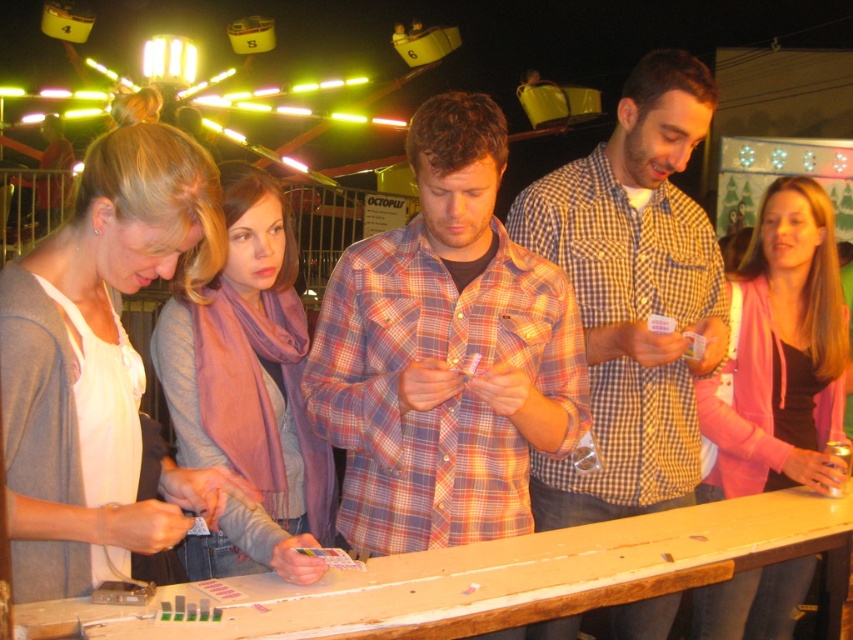
Can you confirm if purple scarf at center is wider than pink fabric jacket at center?

No, purple scarf at center is not wider than pink fabric jacket at center.

Does purple scarf at center appear on the left side of pink fabric jacket at center?

Yes, purple scarf at center is to the left of pink fabric jacket at center.

You are a GUI agent. You are given a task and a screenshot of the screen. Output one action in this format:
    pyautogui.click(x=<x>, y=<y>)
    Task: Click on the purple scarf at center
    The width and height of the screenshot is (853, 640).
    Given the screenshot: What is the action you would take?
    pyautogui.click(x=248, y=388)

Is checkered shirt at center bigger than pink fabric jacket at center?

Indeed, checkered shirt at center has a larger size compared to pink fabric jacket at center.

Is checkered shirt at center to the left of pink fabric jacket at center from the viewer's perspective?

Correct, you'll find checkered shirt at center to the left of pink fabric jacket at center.

Measure the distance between point [599,333] and camera.

The distance of point [599,333] from camera is 7.79 feet.

I want to click on checkered shirt at center, so click(x=633, y=296).

Can you confirm if matte gray cardigan at left is positioned above purple scarf at center?

Indeed, matte gray cardigan at left is positioned over purple scarf at center.

Does point (16, 266) come farther from viewer compared to point (238, 195)?

No, it is in front of (238, 195).

This screenshot has height=640, width=853. What do you see at coordinates (99, 364) in the screenshot?
I see `matte gray cardigan at left` at bounding box center [99, 364].

I want to click on matte gray cardigan at left, so coord(99,364).